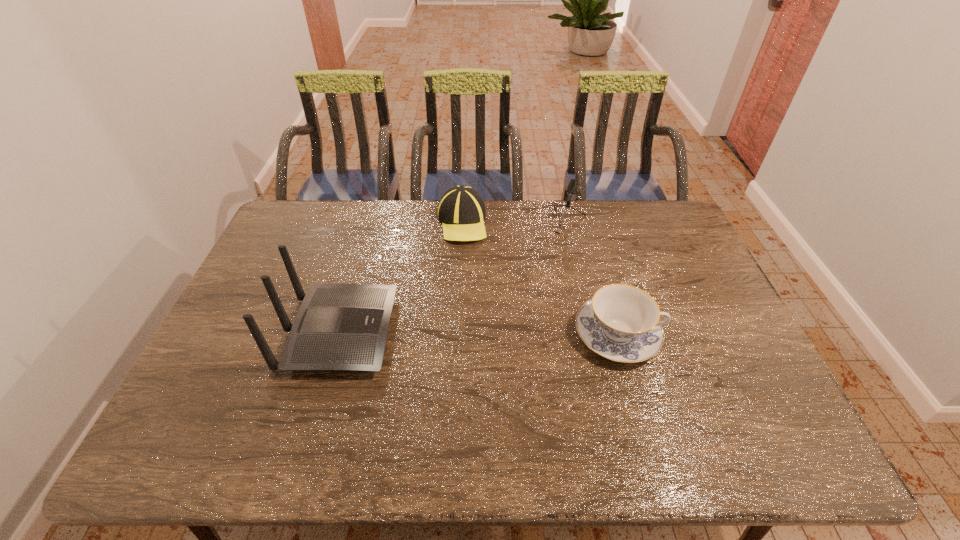
The height and width of the screenshot is (540, 960). Identify the location of vacant region located with the brim of the third object from right to left facing forward. (455, 258).

At what (x,y) coordinates should I click in order to perform the action: click on vacant space positioned with the brim of the third object from right to left facing forward. Please return your answer as a coordinate pair (x, y). Looking at the image, I should click on (443, 320).

Where is `free space located with the brim of the third object from right to left facing forward`? Image resolution: width=960 pixels, height=540 pixels. free space located with the brim of the third object from right to left facing forward is located at coordinates (455, 258).

The width and height of the screenshot is (960, 540). In order to click on microphone that is at the far edge in this screenshot , I will do `click(572, 187)`.

Image resolution: width=960 pixels, height=540 pixels. What are the coordinates of `baseball cap situated at the far edge` in the screenshot? It's located at (461, 210).

In order to click on free space at the far edge of the desktop in this screenshot , I will do `click(533, 230)`.

Where is `vacant space at the near edge of the desktop`? vacant space at the near edge of the desktop is located at coordinates (636, 396).

What are the coordinates of `vacant space at the left edge of the desktop` in the screenshot? It's located at (275, 309).

In the image, there is a desktop. Identify the location of free space at the right edge. This screenshot has height=540, width=960. (698, 357).

Find the location of `vacant area at the far left corner of the desktop`. vacant area at the far left corner of the desktop is located at coordinates (316, 217).